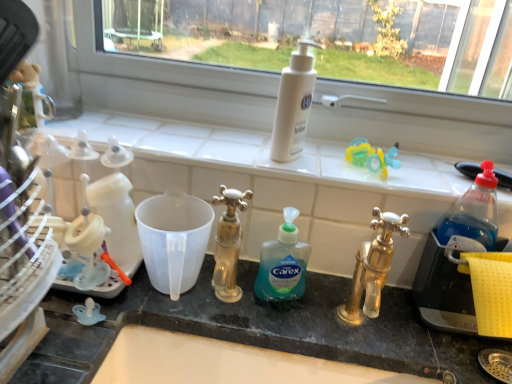
Describe the element at coordinates (283, 263) in the screenshot. This screenshot has height=384, width=512. I see `green translucent liquid soap at center, the second cleaning product viewed from the top` at that location.

Where is `green translucent liquid soap at center, the second cleaning product viewed from the top`? The width and height of the screenshot is (512, 384). green translucent liquid soap at center, the second cleaning product viewed from the top is located at coordinates (283, 263).

What do you see at coordinates (294, 104) in the screenshot?
I see `white matte lotion at upper center, which is the second cleaning product in bottom-to-top order` at bounding box center [294, 104].

In order to face white matte lotion at upper center, which is the second cleaning product in bottom-to-top order, should I rotate leftwards or rightwards?

Rotate right and turn 5.746 degrees.

Measure the distance between white matte lotion at upper center, the first cleaning product from the top, and camera.

The distance of white matte lotion at upper center, the first cleaning product from the top, from camera is 27.97 inches.

Locate an element on the screen. The height and width of the screenshot is (384, 512). white matte lotion at upper center, which is the second cleaning product in bottom-to-top order is located at coordinates (294, 104).

What is the approximate width of white matte lotion at upper center, the first cleaning product from the top?

It is 2.37 inches.

The image size is (512, 384). What are the coordinates of `green translucent liquid soap at center, the 1th cleaning product from the bottom` in the screenshot? It's located at (283, 263).

Based on their positions, is green translucent liquid soap at center, the second cleaning product viewed from the top, located to the left or right of white matte lotion at upper center, which is the second cleaning product in bottom-to-top order?

green translucent liquid soap at center, the second cleaning product viewed from the top, is to the left of white matte lotion at upper center, which is the second cleaning product in bottom-to-top order.

Is green translucent liquid soap at center, the second cleaning product viewed from the top, positioned before white matte lotion at upper center, the first cleaning product from the top?

Yes, green translucent liquid soap at center, the second cleaning product viewed from the top, is closer to the camera.

Which is in front, point (263, 265) or point (303, 57)?

The point (263, 265) is closer to the camera.

Based on the photo, from the image's perspective, is green translucent liquid soap at center, the second cleaning product viewed from the top, above or below white matte lotion at upper center, the first cleaning product from the top?

green translucent liquid soap at center, the second cleaning product viewed from the top, is below white matte lotion at upper center, the first cleaning product from the top.

From a real-world perspective, who is located higher, green translucent liquid soap at center, the 1th cleaning product from the bottom, or white matte lotion at upper center, the first cleaning product from the top?

From a 3D spatial view, white matte lotion at upper center, the first cleaning product from the top, is above.

Is green translucent liquid soap at center, the 1th cleaning product from the bottom, wider or thinner than white matte lotion at upper center, which is the second cleaning product in bottom-to-top order?

Considering their sizes, green translucent liquid soap at center, the 1th cleaning product from the bottom, looks slimmer than white matte lotion at upper center, which is the second cleaning product in bottom-to-top order.

Who is taller, green translucent liquid soap at center, the 1th cleaning product from the bottom, or white matte lotion at upper center, the first cleaning product from the top?

Standing taller between the two is white matte lotion at upper center, the first cleaning product from the top.

Can you confirm if green translucent liquid soap at center, the second cleaning product viewed from the top, is smaller than white matte lotion at upper center, the first cleaning product from the top?

Indeed, green translucent liquid soap at center, the second cleaning product viewed from the top, has a smaller size compared to white matte lotion at upper center, the first cleaning product from the top.

Is green translucent liquid soap at center, the second cleaning product viewed from the top, inside or outside of white matte lotion at upper center, which is the second cleaning product in bottom-to-top order?

green translucent liquid soap at center, the second cleaning product viewed from the top, cannot be found inside white matte lotion at upper center, which is the second cleaning product in bottom-to-top order.

Is green translucent liquid soap at center, the 1th cleaning product from the bottom, with white matte lotion at upper center, which is the second cleaning product in bottom-to-top order?

No, green translucent liquid soap at center, the 1th cleaning product from the bottom, is not beside white matte lotion at upper center, which is the second cleaning product in bottom-to-top order.

Is green translucent liquid soap at center, the 1th cleaning product from the bottom, oriented towards white matte lotion at upper center, the first cleaning product from the top?

No.

Locate an element on the screen. This screenshot has height=384, width=512. cleaning product above the green translucent liquid soap at center, the second cleaning product viewed from the top (from the image's perspective) is located at coordinates (294, 104).

Based on their positions, is white matte lotion at upper center, which is the second cleaning product in bottom-to-top order, located to the left or right of green translucent liquid soap at center, the 1th cleaning product from the bottom?

white matte lotion at upper center, which is the second cleaning product in bottom-to-top order, is positioned on green translucent liquid soap at center, the 1th cleaning product from the bottom,'s right side.

Which object is further away from the camera taking this photo, white matte lotion at upper center, the first cleaning product from the top, or green translucent liquid soap at center, the second cleaning product viewed from the top?

white matte lotion at upper center, the first cleaning product from the top, is more distant.

Between point (314, 79) and point (265, 247), which one is positioned behind?

The point (314, 79) is farther.

From the image's perspective, between white matte lotion at upper center, the first cleaning product from the top, and green translucent liquid soap at center, the 1th cleaning product from the bottom, which one is located above?

white matte lotion at upper center, the first cleaning product from the top, from the image's perspective.

From a real-world perspective, is white matte lotion at upper center, which is the second cleaning product in bottom-to-top order, beneath green translucent liquid soap at center, the 1th cleaning product from the bottom?

Actually, white matte lotion at upper center, which is the second cleaning product in bottom-to-top order, is physically above green translucent liquid soap at center, the 1th cleaning product from the bottom, in the real world.

Looking at this image, in terms of width, does white matte lotion at upper center, which is the second cleaning product in bottom-to-top order, look wider or thinner when compared to green translucent liquid soap at center, the 1th cleaning product from the bottom?

In the image, white matte lotion at upper center, which is the second cleaning product in bottom-to-top order, appears to be wider than green translucent liquid soap at center, the 1th cleaning product from the bottom.

In the scene shown: Who is taller, white matte lotion at upper center, which is the second cleaning product in bottom-to-top order, or green translucent liquid soap at center, the second cleaning product viewed from the top?

white matte lotion at upper center, which is the second cleaning product in bottom-to-top order.

Does white matte lotion at upper center, the first cleaning product from the top, have a larger size compared to green translucent liquid soap at center, the second cleaning product viewed from the top?

Yes, white matte lotion at upper center, the first cleaning product from the top, is bigger than green translucent liquid soap at center, the second cleaning product viewed from the top.

Is white matte lotion at upper center, which is the second cleaning product in bottom-to-top order, inside or outside of green translucent liquid soap at center, the 1th cleaning product from the bottom?

white matte lotion at upper center, which is the second cleaning product in bottom-to-top order, is outside green translucent liquid soap at center, the 1th cleaning product from the bottom.

Are white matte lotion at upper center, which is the second cleaning product in bottom-to-top order, and green translucent liquid soap at center, the 1th cleaning product from the bottom, making contact?

No, white matte lotion at upper center, which is the second cleaning product in bottom-to-top order, is not in contact with green translucent liquid soap at center, the 1th cleaning product from the bottom.

Could you tell me if white matte lotion at upper center, which is the second cleaning product in bottom-to-top order, is turned towards green translucent liquid soap at center, the second cleaning product viewed from the top?

No, white matte lotion at upper center, which is the second cleaning product in bottom-to-top order, does not turn towards green translucent liquid soap at center, the second cleaning product viewed from the top.

How much distance is there between white matte lotion at upper center, which is the second cleaning product in bottom-to-top order, and green translucent liquid soap at center, the second cleaning product viewed from the top?

white matte lotion at upper center, which is the second cleaning product in bottom-to-top order, is 7.96 inches from green translucent liquid soap at center, the second cleaning product viewed from the top.

Locate an element on the screen. This screenshot has height=384, width=512. cleaning product behind the green translucent liquid soap at center, the 1th cleaning product from the bottom is located at coordinates [294, 104].

What are the coordinates of `cleaning product that appears above the green translucent liquid soap at center, the 1th cleaning product from the bottom (from the image's perspective)` in the screenshot? It's located at (294, 104).

Locate an element on the screen. This screenshot has height=384, width=512. cleaning product located behind the green translucent liquid soap at center, the 1th cleaning product from the bottom is located at coordinates (294, 104).